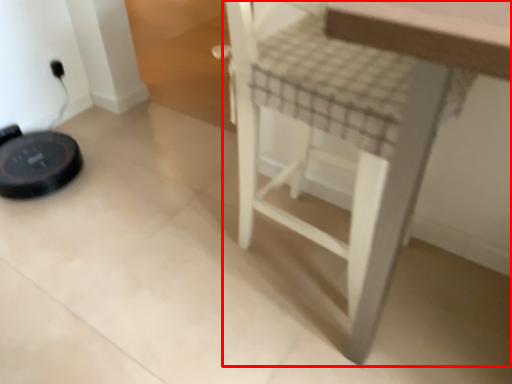
Question: Observing the image, what is the correct spatial positioning of furniture (annotated by the red box) in reference to electric outlet?

Choices:
 (A) right
 (B) left

Answer: (A)